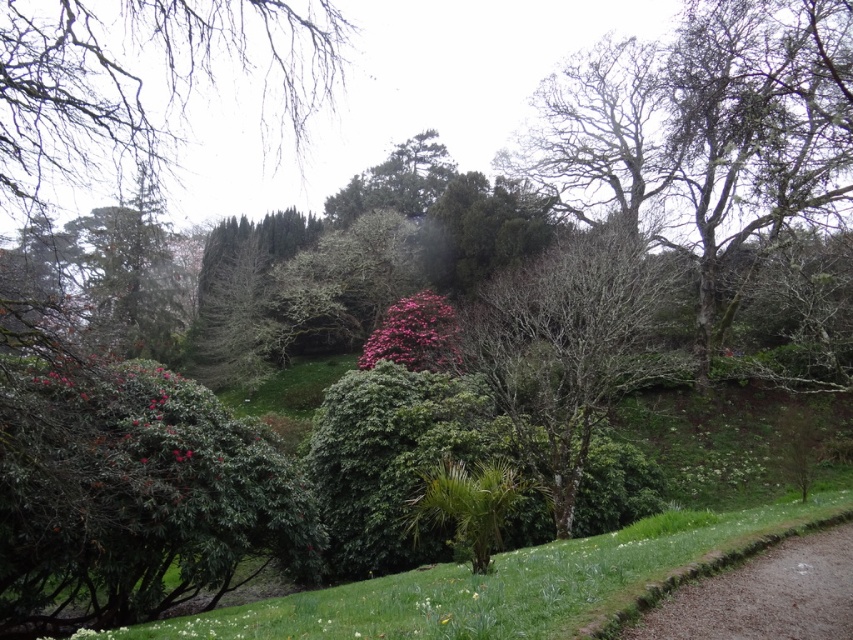
Can you confirm if bare bark tree at center is smaller than brown gravel path at lower right?

Incorrect, bare bark tree at center is not smaller in size than brown gravel path at lower right.

Measure the distance between bare bark tree at center and camera.

bare bark tree at center is 41.97 feet from camera.

Identify the location of bare bark tree at center. The width and height of the screenshot is (853, 640). (572, 346).

Which of these two, bare branches at upper left or pink matte flower at center, stands shorter?

pink matte flower at center is shorter.

Who is more forward, (224, 1) or (380, 353)?

Point (224, 1) is more forward.

The image size is (853, 640). Find the location of `bare branches at upper left`. bare branches at upper left is located at coordinates (149, 81).

Is bare bark tree at center thinner than pink matte flower at center?

Incorrect, bare bark tree at center's width is not less than pink matte flower at center's.

Can you confirm if bare bark tree at center is smaller than pink matte flower at center?

Incorrect, bare bark tree at center is not smaller in size than pink matte flower at center.

Who is more forward, (569, 273) or (403, 349)?

Point (569, 273) is in front.

You are a GUI agent. You are given a task and a screenshot of the screen. Output one action in this format:
    pyautogui.click(x=<x>, y=<y>)
    Task: Click on the bare bark tree at center
    Image resolution: width=853 pixels, height=640 pixels.
    Given the screenshot: What is the action you would take?
    pyautogui.click(x=572, y=346)